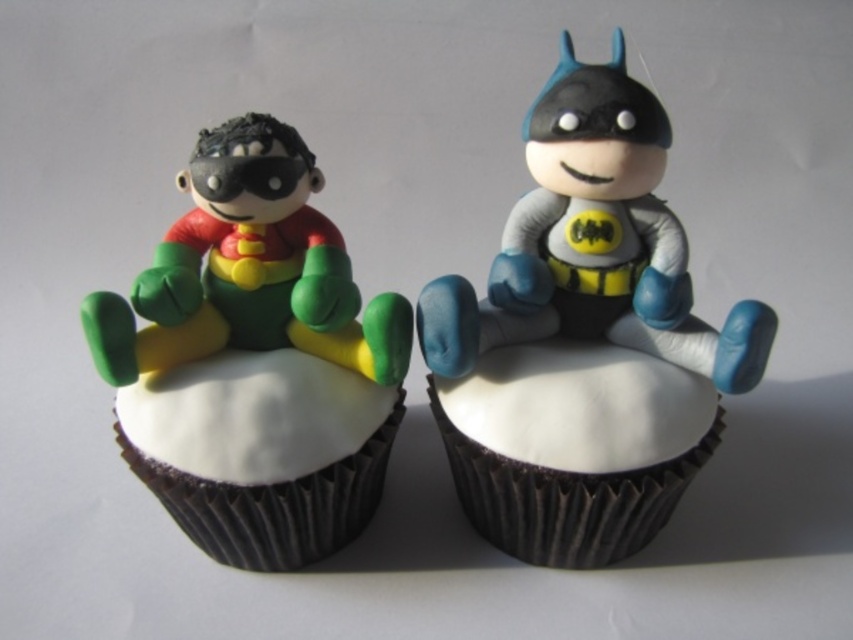
Question: Which point appears farthest from the camera in this image?

Choices:
 (A) [515, 540]
 (B) [653, 204]
 (C) [292, 388]
 (D) [253, 387]

Answer: (A)

Question: Can you confirm if white matte cupcake at center is positioned to the left of white smooth cupcake at center?

Choices:
 (A) yes
 (B) no

Answer: (B)

Question: Which object is the farthest from the matte green plastic toy at left?

Choices:
 (A) white smooth cupcake at center
 (B) matte gray batman at center

Answer: (B)

Question: Which object is the closest to the matte gray batman at center?

Choices:
 (A) white matte cupcake at center
 (B) matte green plastic toy at left

Answer: (A)

Question: Does matte gray batman at center have a greater width compared to white matte cupcake at center?

Choices:
 (A) yes
 (B) no

Answer: (A)

Question: Considering the relative positions of matte green plastic toy at left and white matte cupcake at center in the image provided, where is matte green plastic toy at left located with respect to white matte cupcake at center?

Choices:
 (A) above
 (B) below

Answer: (A)